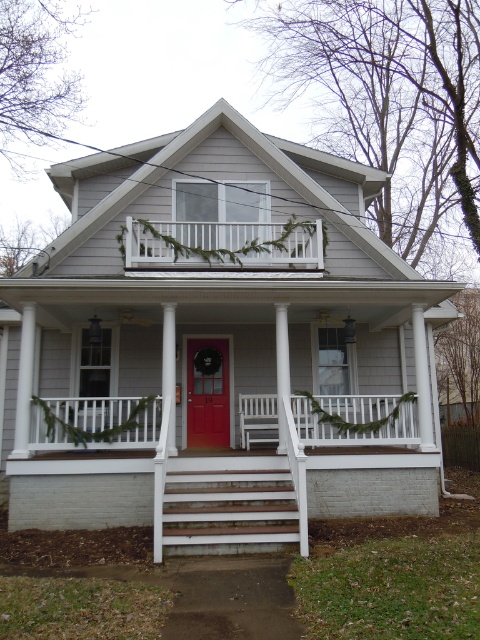
Who is higher up, white painted wood porch at upper center or matte red door at center?

white painted wood porch at upper center is higher up.

Which is below, white painted wood porch at upper center or matte red door at center?

matte red door at center

Between point (248, 257) and point (194, 390), which one is positioned in front?

Positioned in front is point (248, 257).

Where is `white painted wood porch at upper center`? white painted wood porch at upper center is located at coordinates tap(223, 243).

Can you confirm if wooden stairs at center is smaller than white painted wood porch at upper center?

Indeed, wooden stairs at center has a smaller size compared to white painted wood porch at upper center.

Which is in front, point (286, 538) or point (144, 253)?

Point (286, 538) is in front.

Where is `wooden stairs at center`? wooden stairs at center is located at coordinates (228, 508).

Who is taller, wooden stairs at center or matte red door at center?

matte red door at center

Which is behind, point (223, 477) or point (208, 349)?

Point (208, 349)

You are a GUI agent. You are given a task and a screenshot of the screen. Output one action in this format:
    pyautogui.click(x=<x>, y=<y>)
    Task: Click on the wooden stairs at center
    This screenshot has height=640, width=480.
    Given the screenshot: What is the action you would take?
    pyautogui.click(x=228, y=508)